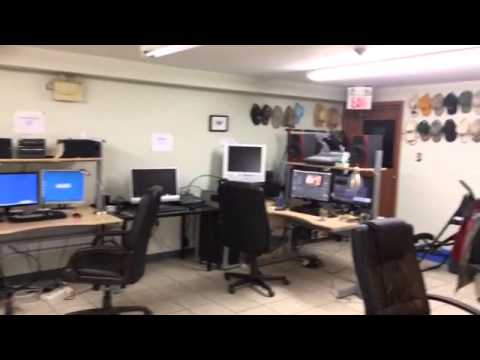
The height and width of the screenshot is (360, 480). Identify the location of frames. (226, 129).